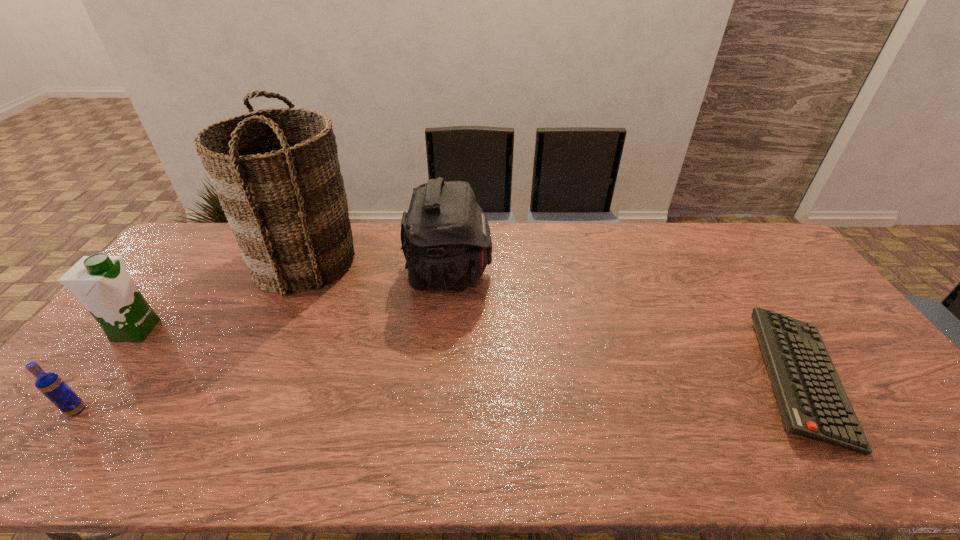
Identify the location of basket. This screenshot has width=960, height=540. (276, 172).

Image resolution: width=960 pixels, height=540 pixels. I want to click on the third object from right to left, so 276,172.

You are a GUI agent. You are given a task and a screenshot of the screen. Output one action in this format:
    pyautogui.click(x=<x>, y=<y>)
    Task: Click on the shoulder bag
    This screenshot has height=540, width=960.
    Given the screenshot: What is the action you would take?
    pyautogui.click(x=446, y=240)

Locate an element on the screen. This screenshot has width=960, height=540. the second object from right to left is located at coordinates (446, 240).

The image size is (960, 540). I want to click on soya milk, so click(x=101, y=282).

Image resolution: width=960 pixels, height=540 pixels. What are the coordinates of `the fourth tallest object` in the screenshot? It's located at (49, 384).

This screenshot has height=540, width=960. I want to click on the shortest object, so click(x=813, y=402).

You are a GUI agent. You are given a task and a screenshot of the screen. Output one action in this format:
    pyautogui.click(x=<x>, y=<y>)
    Task: Click on the computer keyboard
    This screenshot has width=960, height=540.
    Given the screenshot: What is the action you would take?
    pyautogui.click(x=813, y=402)

Locate an element on the screen. This screenshot has width=960, height=540. free location located 0.260m on the left of the tallest object is located at coordinates (178, 261).

The height and width of the screenshot is (540, 960). Find the location of `vacant space located 0.060m on the open flap of the fourth shortest object`. vacant space located 0.060m on the open flap of the fourth shortest object is located at coordinates (510, 274).